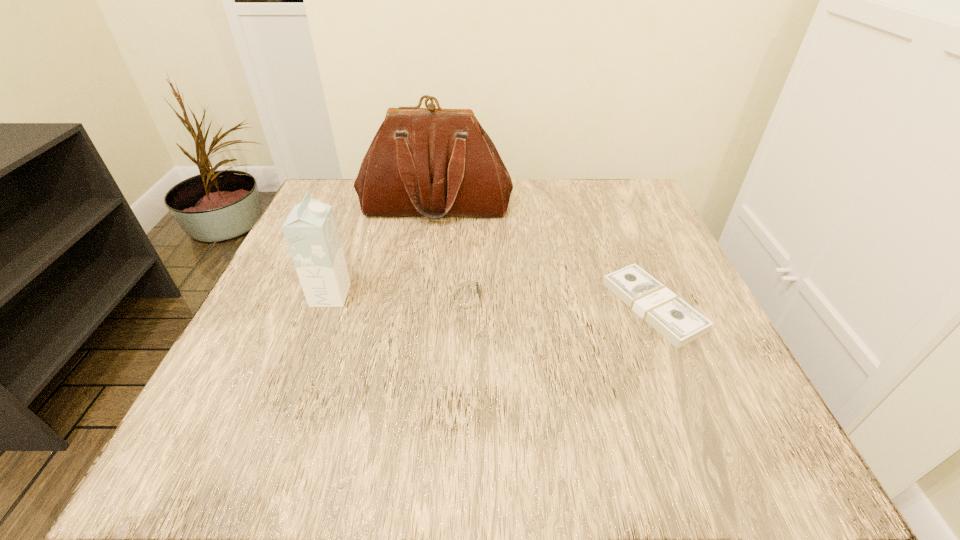
At what (x,y) coordinates should I click in order to perform the action: click on the farthest object. Please return your answer as a coordinate pair (x, y). This screenshot has height=540, width=960. Looking at the image, I should click on (432, 162).

Locate an element on the screen. This screenshot has height=540, width=960. the tallest object is located at coordinates [x=432, y=162].

What are the coordinates of `the second tallest object` in the screenshot? It's located at (310, 230).

Locate an element on the screen. Image resolution: width=960 pixels, height=540 pixels. watch is located at coordinates (466, 296).

Find the location of a particular element. Image resolution: width=960 pixels, height=540 pixels. the rightmost object is located at coordinates click(x=678, y=322).

Where is `dollar`? This screenshot has width=960, height=540. dollar is located at coordinates (678, 322).

The image size is (960, 540). Find the location of `free space located on the front of the tallest object`. free space located on the front of the tallest object is located at coordinates [431, 241].

Locate an element on the screen. This screenshot has height=540, width=960. vacant region located on the front label of the carton is located at coordinates (522, 295).

You are a GUI agent. You are given a task and a screenshot of the screen. Output one action in this format:
    pyautogui.click(x=<x>, y=<y>)
    Task: Click on the vacant region located 0.330m on the face of the second shortest object
    This screenshot has height=540, width=960.
    Given the screenshot: What is the action you would take?
    pyautogui.click(x=679, y=295)

This screenshot has height=540, width=960. I want to click on blank space located on the left of the rightmost object, so click(502, 306).